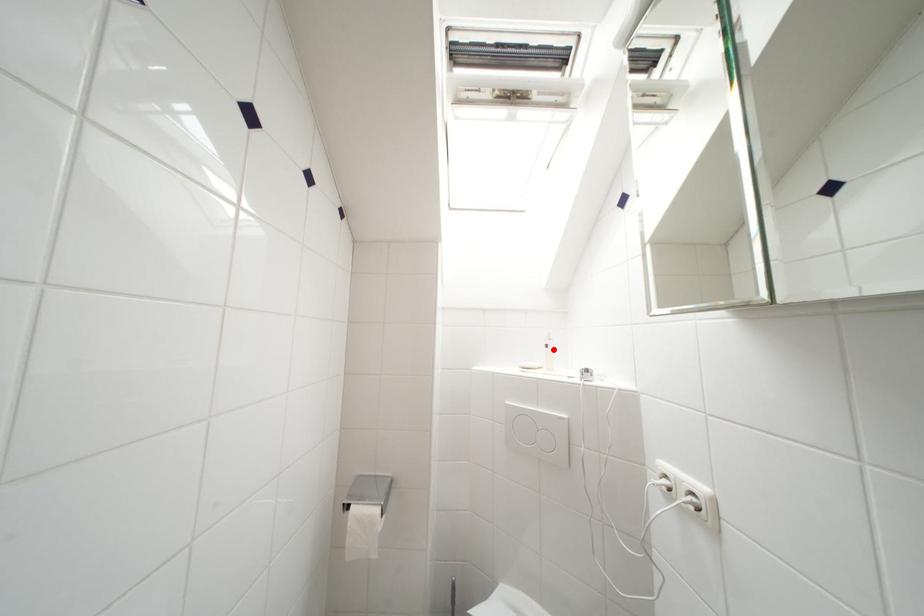
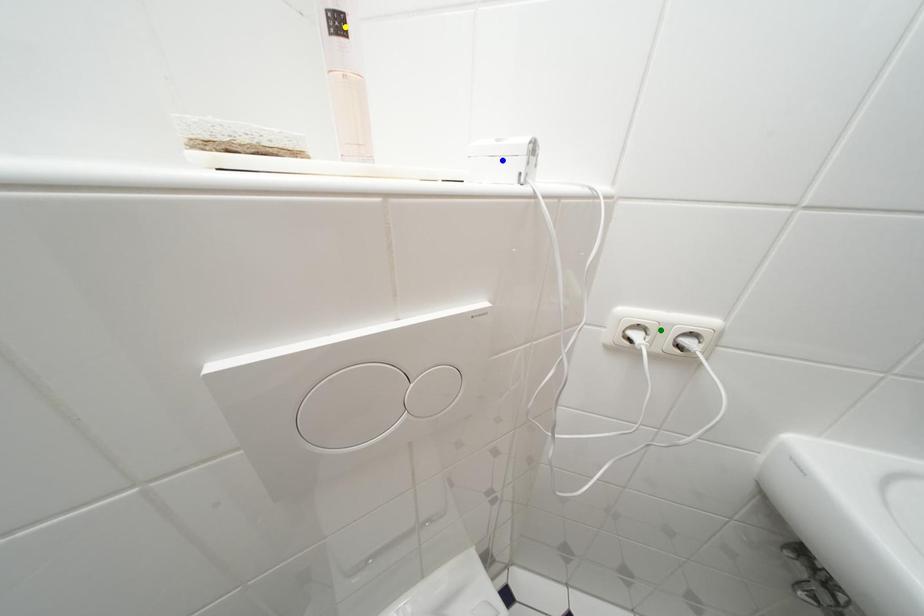
Question: I am providing you with two images of the same scene from different viewpoints. A red point is marked on the first image. You are given multiple points on the second image. In image 2, which mark is for the same physical point as the one in image 1?

Choices:
 (A) green point
 (B) yellow point
 (C) blue point

Answer: (B)